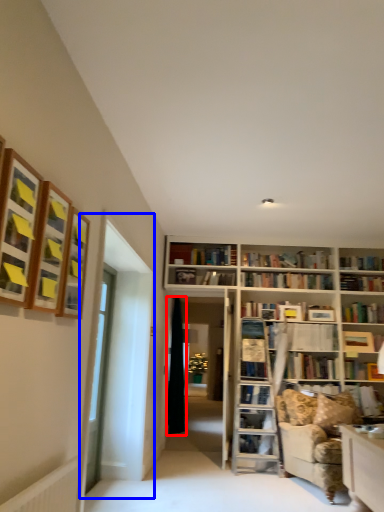
Question: Which point is closer to the camera, curtain (highlighted by a red box) or glass door (highlighted by a blue box)?

Choices:
 (A) curtain
 (B) glass door

Answer: (B)